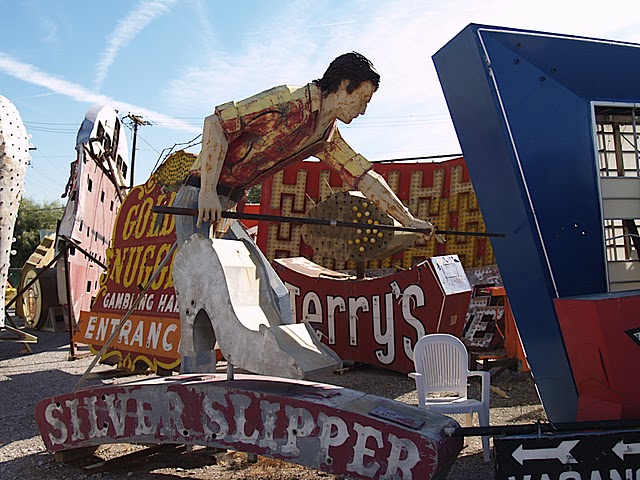
The height and width of the screenshot is (480, 640). In order to click on wooden statue in this screenshot , I will do `click(324, 110)`.